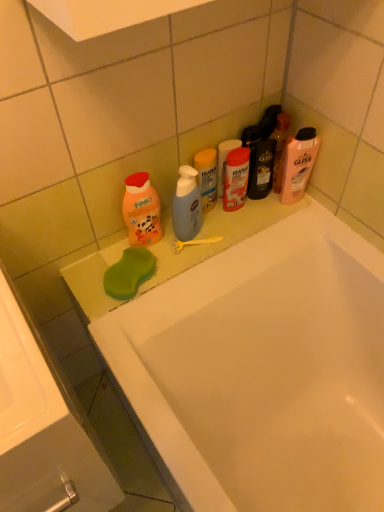
Locate an element on the screen. The height and width of the screenshot is (512, 384). free spot to the left of pink matte shampoo at upper right, the 1th cleaning product positioned from the right is located at coordinates click(x=246, y=219).